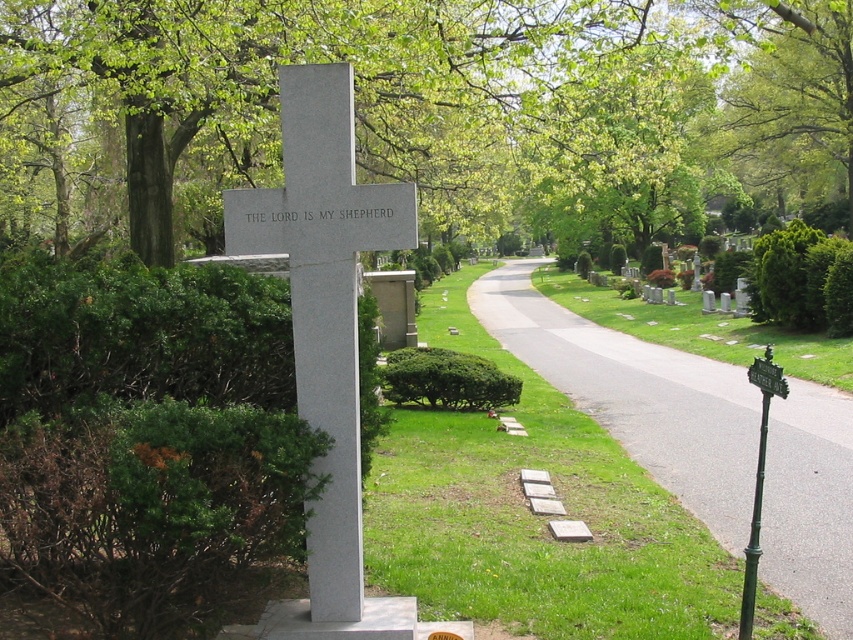
Is point (74, 20) closer to viewer compared to point (339, 557)?

No, (74, 20) is further to viewer.

Is green leafy tree at upper left thinner than white polished stone cross at center?

Incorrect, green leafy tree at upper left's width is not less than white polished stone cross at center's.

Which is in front, point (573, 22) or point (344, 273)?

Positioned in front is point (344, 273).

You are a GUI agent. You are given a task and a screenshot of the screen. Output one action in this format:
    pyautogui.click(x=<x>, y=<y>)
    Task: Click on the green leafy tree at upper left
    The width and height of the screenshot is (853, 640).
    Given the screenshot: What is the action you would take?
    pyautogui.click(x=425, y=113)

Does green leafy tree at upper left have a lesser width compared to asphalt road at center?

Incorrect, green leafy tree at upper left's width is not less than asphalt road at center's.

Image resolution: width=853 pixels, height=640 pixels. I want to click on green leafy tree at upper left, so click(425, 113).

Who is more distant from viewer, (x=689, y=435) or (x=329, y=337)?

Positioned behind is point (x=689, y=435).

Which of these two, asphalt road at center or white polished stone cross at center, stands taller?

asphalt road at center

Who is more forward, (767, 577) or (293, 269)?

Positioned in front is point (293, 269).

Find the location of a particular element. asphalt road at center is located at coordinates (637, 396).